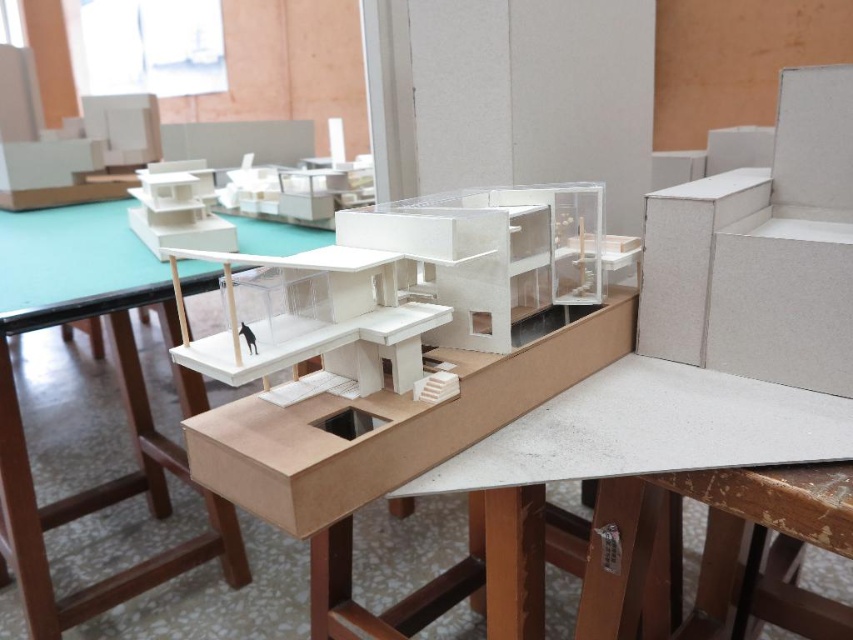
You are an architect reviewing the model of a modern house. You need to place a scale model of a tree next to the white cardboard table at center. Where should you place it to ensure it aligns with the architectural model? Please provide coordinates based on the image coordinate system where the bottom left corner is the origin.

The white cardboard table at center is located at coordinates point (120,387), so placing the tree model near these coordinates would align it with the architectural model.

You are an architect examining the architectural model on the table. You notice the white matte dog at center and the white cardboard table at center. Which object is closer to you from your viewing position?

The white cardboard table at center is closer to you because the white matte dog at center is positioned behind it.